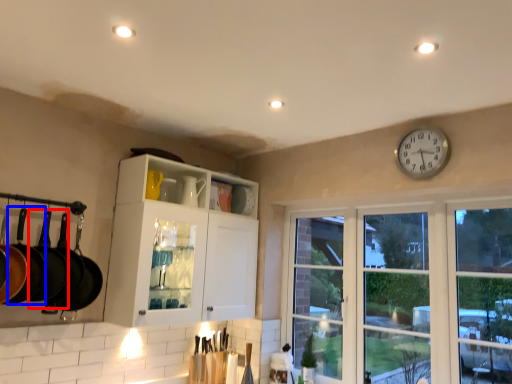
Question: Which of the following is the closest to the observer, frying pan (highlighted by a red box) or frying pan (highlighted by a blue box)?

Choices:
 (A) frying pan
 (B) frying pan

Answer: (B)